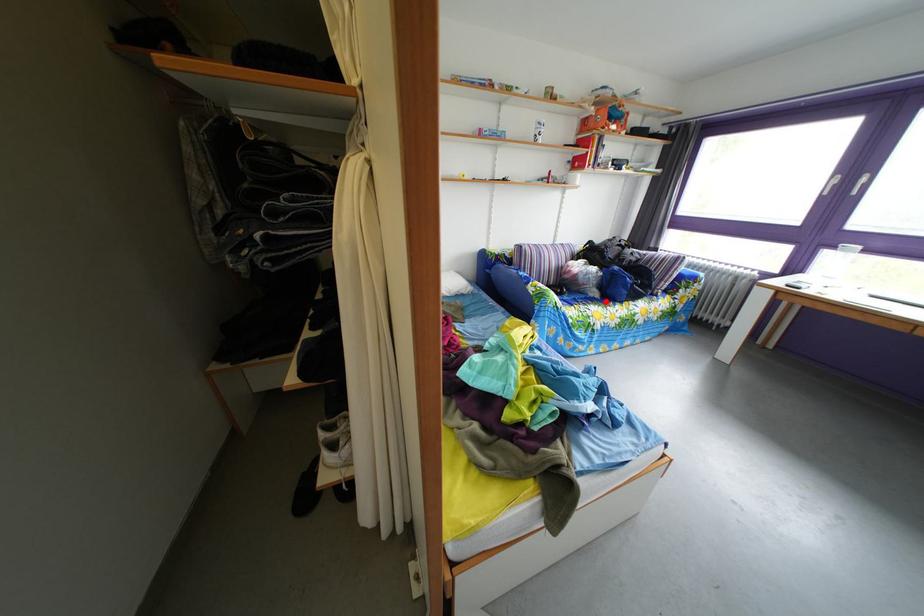
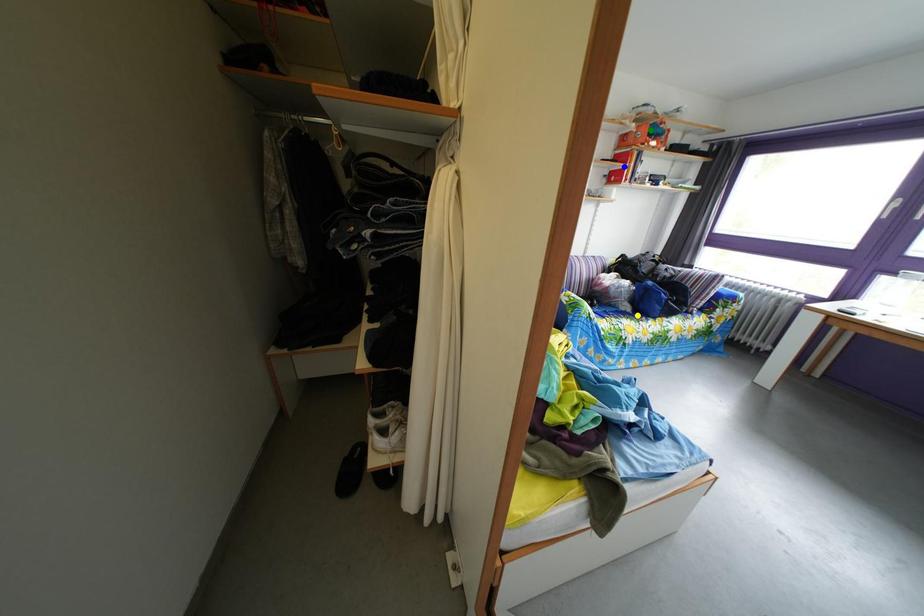
Question: I am providing you with two images of the same scene from different viewpoints. A red point is marked on the first image. You are given multiple points on the second image. Which point in image 2 represents the same 3d spot as the red point in image 1?

Choices:
 (A) green point
 (B) yellow point
 (C) blue point

Answer: (B)